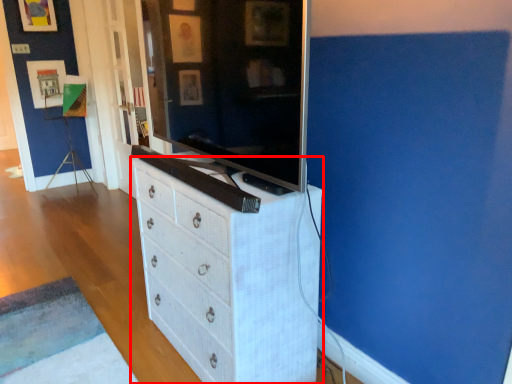
Question: From the image's perspective, considering the relative positions of chest of drawers (annotated by the red box) and television in the image provided, where is chest of drawers (annotated by the red box) located with respect to the staircase?

Choices:
 (A) above
 (B) below

Answer: (B)